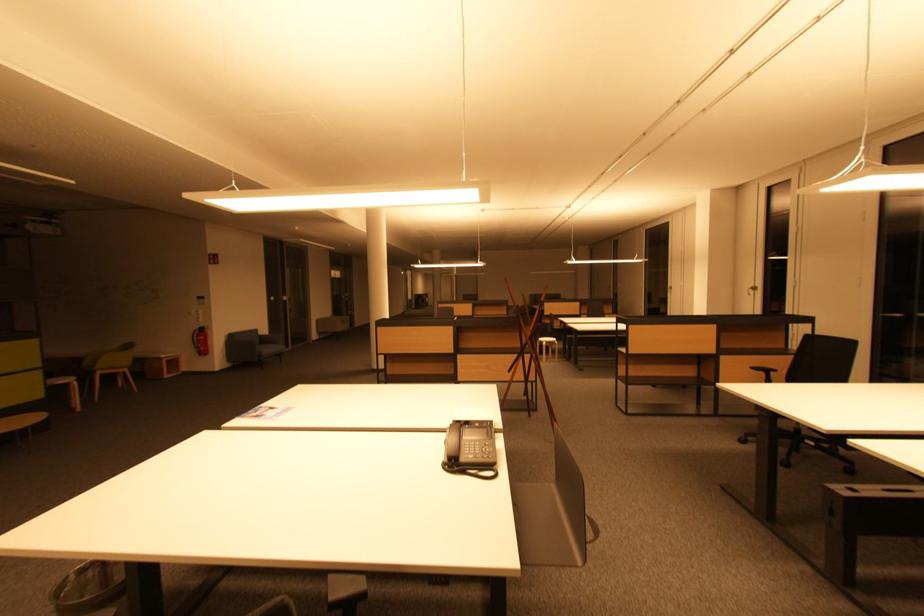
Where would you sit the green chair sitting surface? Please return your answer as a coordinate pair (x, y).

(108, 368)